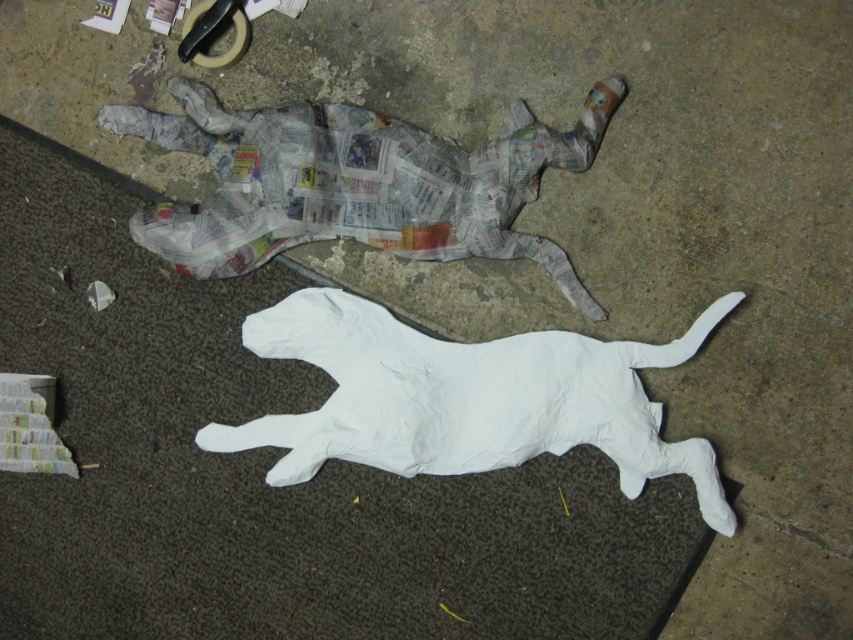
You are standing 1.5 meters away from the image. If you want to touch the point at coordinates point (492, 253), will you be able to reach it without moving closer?

The distance of point (492, 253) from viewer is 1.29 meters. Since you are standing 1.5 meters away, you are farther than the point, so you can reach it without moving closer.